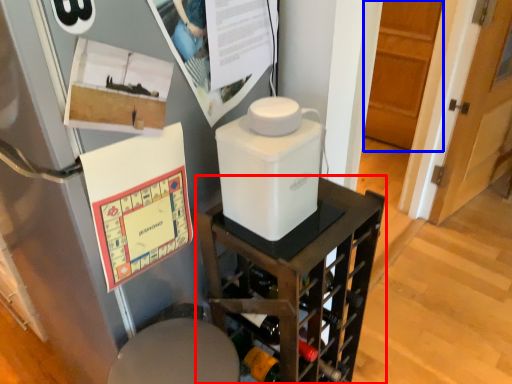
Question: Which point is closer to the camera, furniture (highlighted by a red box) or door (highlighted by a blue box)?

Choices:
 (A) furniture
 (B) door

Answer: (A)